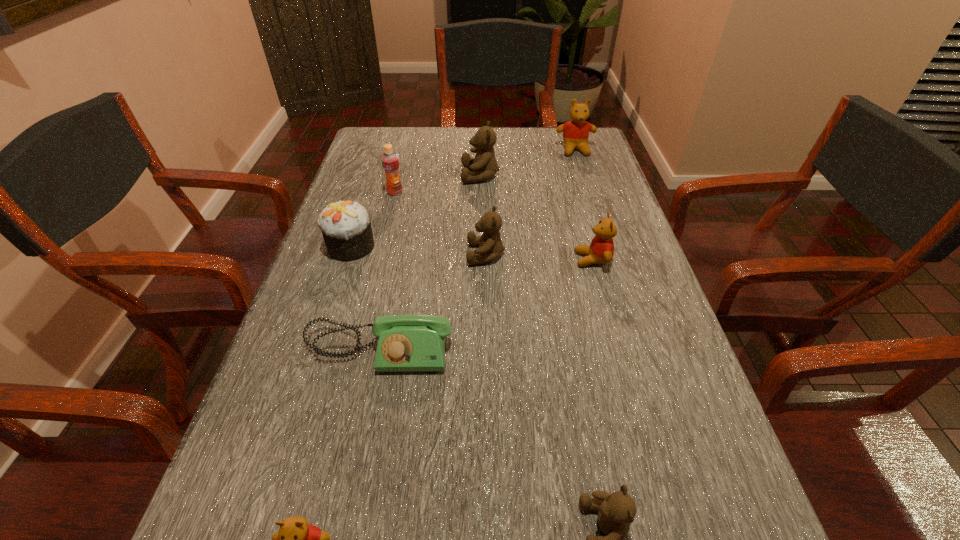
At what (x,y) coordinates should I click in order to perform the action: click on blank space located 0.160m on the front-facing side of the farthest brown teddy bear. Please return your answer as a coordinate pair (x, y). This screenshot has height=540, width=960. Looking at the image, I should click on (406, 175).

This screenshot has height=540, width=960. I want to click on free space located on the front-facing side of the farthest brown teddy bear, so click(x=426, y=175).

Find the location of a particular element. The width and height of the screenshot is (960, 540). free space located on the front-facing side of the farthest brown teddy bear is located at coordinates (353, 175).

You are a GUI agent. You are given a task and a screenshot of the screen. Output one action in this format:
    pyautogui.click(x=<x>, y=<y>)
    Task: Click on the vacant space situated on the front-facing side of the farthest teddy bear
    
    Given the screenshot: What is the action you would take?
    tap(584, 177)

At what (x,y) coordinates should I click in order to perform the action: click on blank area located 0.240m on the front of the seventh nearest object. Please return your answer as a coordinate pair (x, y). This screenshot has height=540, width=960. Looking at the image, I should click on (379, 255).

The height and width of the screenshot is (540, 960). Find the location of `free spot located 0.380m on the front-facing side of the second nearest red teddy bear`. free spot located 0.380m on the front-facing side of the second nearest red teddy bear is located at coordinates (409, 259).

I want to click on free point located on the front-facing side of the second nearest red teddy bear, so click(440, 259).

Identify the location of free spot located on the front-facing side of the second nearest red teddy bear. The width and height of the screenshot is (960, 540). (549, 259).

Identify the location of free space located 0.080m on the front-facing side of the second nearest brown teddy bear. (432, 254).

Where is `vacant space situated on the front-facing side of the second nearest brown teddy bear`? vacant space situated on the front-facing side of the second nearest brown teddy bear is located at coordinates (428, 254).